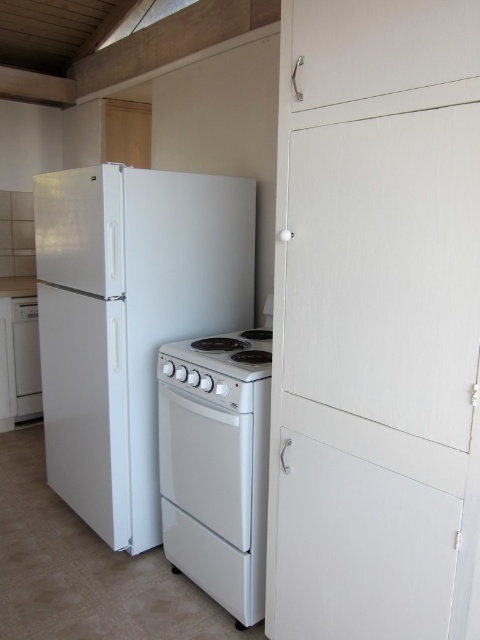
Between white matte refrigerator at left and white glossy gas stove at center, which one is positioned higher?

white glossy gas stove at center is above.

Does white matte refrigerator at left appear on the left side of white glossy gas stove at center?

Yes, white matte refrigerator at left is to the left of white glossy gas stove at center.

Which is behind, point (57, 330) or point (216, 348)?

Positioned behind is point (57, 330).

You are a GUI agent. You are given a task and a screenshot of the screen. Output one action in this format:
    pyautogui.click(x=<x>, y=<y>)
    Task: Click on the white matte refrigerator at left
    
    Given the screenshot: What is the action you would take?
    pyautogui.click(x=129, y=321)

Which is in front, point (141, 464) or point (197, 362)?

Point (197, 362)

Between white matte refrigerator at left and white glossy oven at center, which one appears on the left side from the viewer's perspective?

Positioned to the left is white matte refrigerator at left.

Identify the location of white matte refrigerator at left. The image size is (480, 640). (129, 321).

Does white glossy oven at center appear on the right side of white glossy gas stove at center?

Indeed, white glossy oven at center is positioned on the right side of white glossy gas stove at center.

Who is more distant from viewer, (168, 378) or (189, 340)?

The point (189, 340) is more distant.

Identify the location of white glossy oven at center. This screenshot has height=640, width=480. (216, 465).